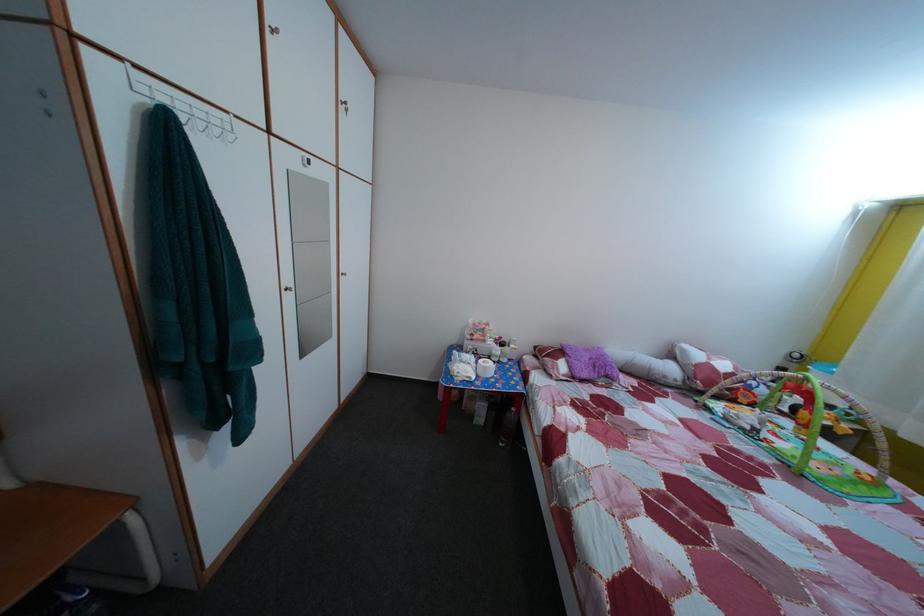
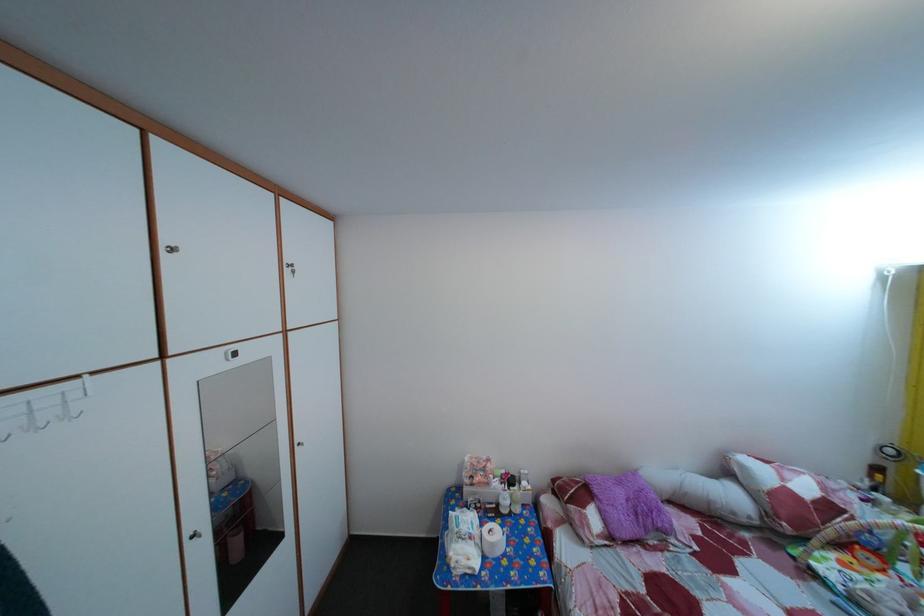
Locate, in the second image, the point that corresponds to point (514, 350) in the first image.

(524, 485)